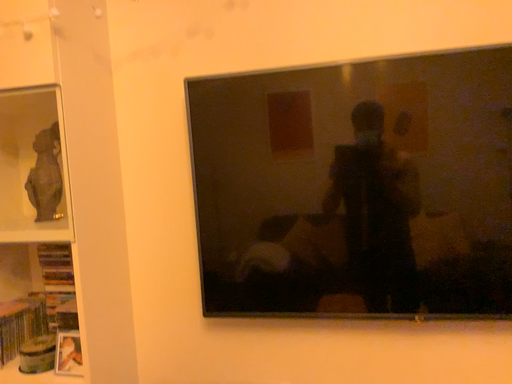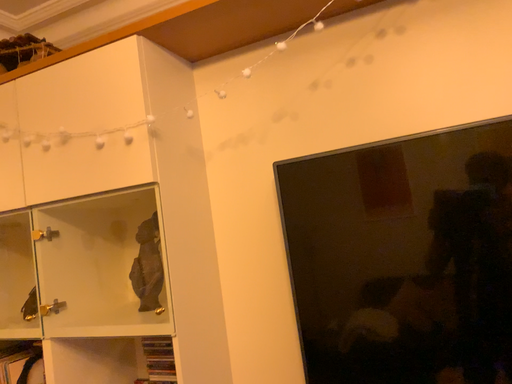
Question: Which way did the camera rotate in the video?

Choices:
 (A) rotated downward
 (B) rotated upward

Answer: (B)